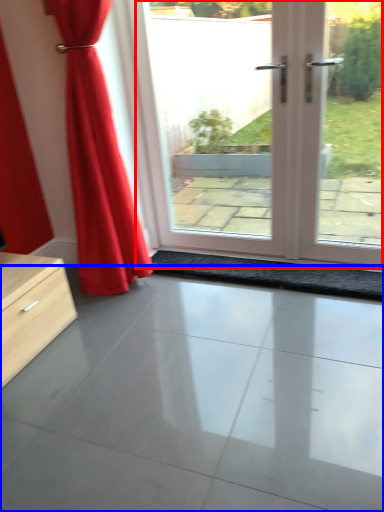
Question: Which object appears closest to the camera in this image, door (highlighted by a red box) or concrete (highlighted by a blue box)?

Choices:
 (A) door
 (B) concrete

Answer: (B)